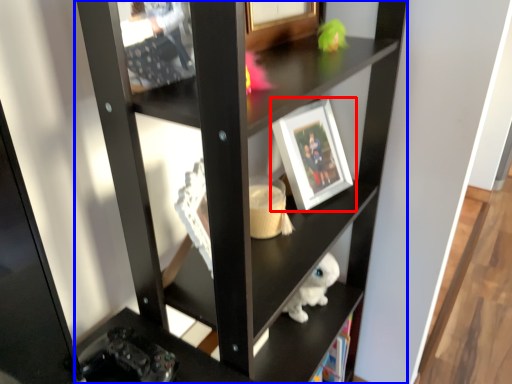
Question: Among these objects, which one is nearest to the camera, picture frame (highlighted by a red box) or shelf (highlighted by a blue box)?

Choices:
 (A) picture frame
 (B) shelf

Answer: (B)